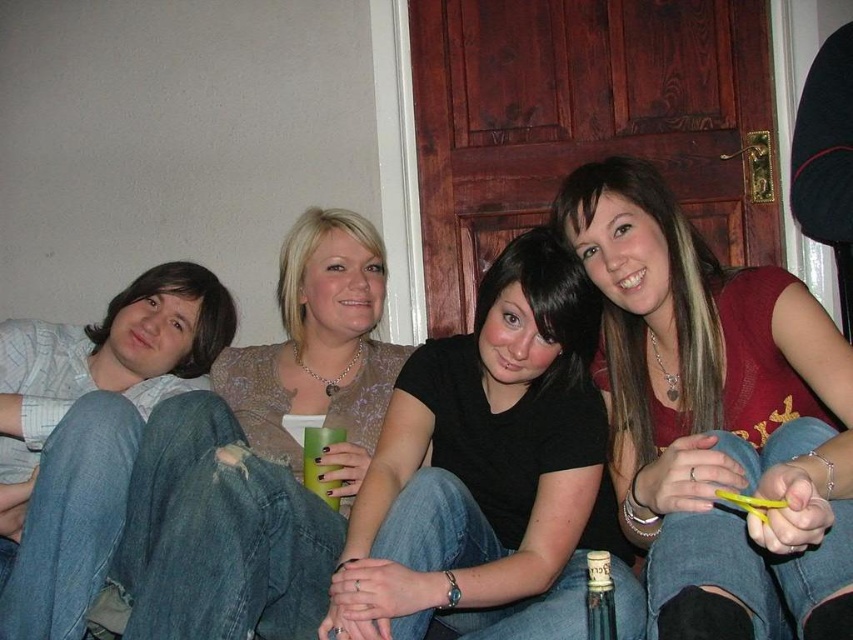
You are arranging a small table for a photoshoot and need to place the matte red sweater at center and the translucent glass bottle at lower center. According to the scene description, which object should be placed to the left of the other?

The translucent glass bottle at lower center should be placed to the left of the matte red sweater at center because the matte red sweater at center is to the right of the translucent glass bottle at lower center.

You are a photographer trying to adjust the lighting for a group photo. You notice the matte red sweater at center and the black matte shirt at center. Which clothing item is closer to the camera?

The matte red sweater at center is closer to the camera because it is in front of the black matte shirt at center.

You are standing in a room with a wooden door and white walls. You see a person wearing a light shirt and jeans on the far left, a woman with a green cup next to them, and the matte red sweater at center. Based on their positions, which object is closer to the door?

The matte red sweater at center is closer to the door because it is positioned at point (x=717, y=419), which is closer to the door compared to the other individuals.